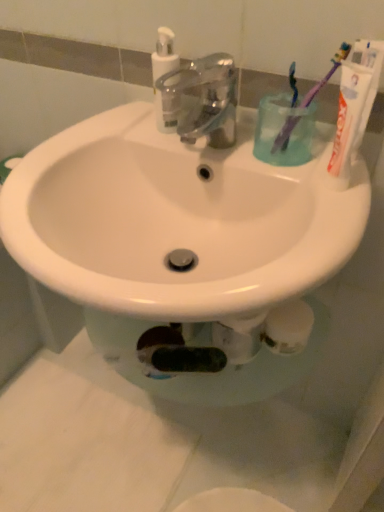
Locate an element on the screen. free space that is to the left of translucent plastic pump bottle at upper center is located at coordinates (97, 134).